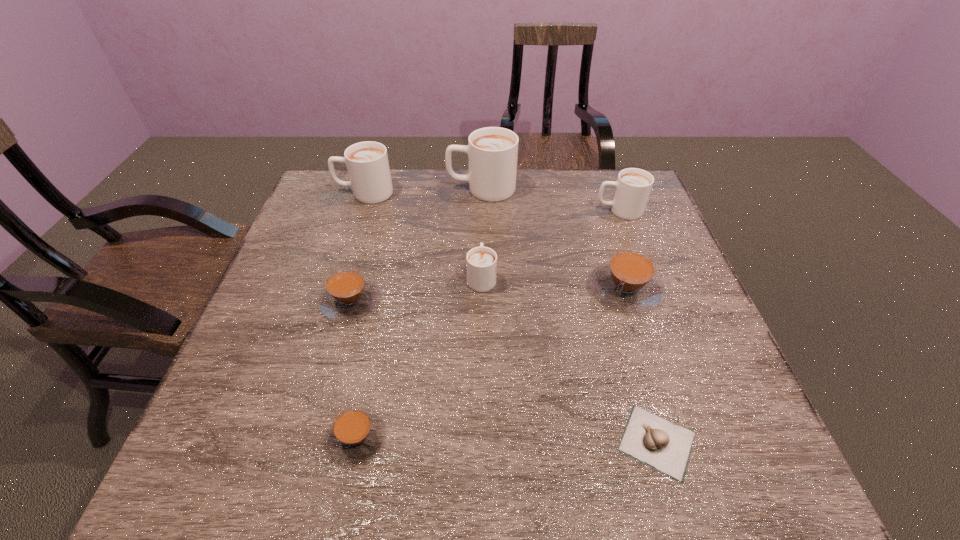
Identify the location of the nearest cappuccino. This screenshot has width=960, height=540. (356, 434).

At what (x,y) coordinates should I click in order to perform the action: click on garlic. Please return your answer as a coordinate pair (x, y). This screenshot has width=960, height=540. Looking at the image, I should click on (665, 446).

The image size is (960, 540). I want to click on vacant region located on the side with the handle of the tallest object, so click(x=333, y=188).

Find the location of a particular element. The width and height of the screenshot is (960, 540). vacant point located 0.190m on the side with the handle of the tallest object is located at coordinates (387, 188).

Where is `vacant region located on the side with the handle of the tallest object`? vacant region located on the side with the handle of the tallest object is located at coordinates pyautogui.click(x=336, y=188).

Image resolution: width=960 pixels, height=540 pixels. What are the coordinates of `vacant space situated on the side with the handle of the second smallest white cappuccino` in the screenshot? It's located at (531, 210).

The image size is (960, 540). Identify the location of free space located 0.250m on the side with the handle of the second smallest white cappuccino. (511, 210).

I want to click on free point located 0.400m on the side with the handle of the second smallest white cappuccino, so click(x=460, y=210).

Identify the location of free region located on the front of the biggest brown cappuccino. Image resolution: width=960 pixels, height=540 pixels. (660, 393).

You are a GUI agent. You are given a task and a screenshot of the screen. Output one action in this format:
    pyautogui.click(x=<x>, y=<y>)
    Task: Click on the free space located on the side with the handle of the nearest white cappuccino
    The image size is (960, 540).
    Given the screenshot: What is the action you would take?
    pyautogui.click(x=482, y=249)